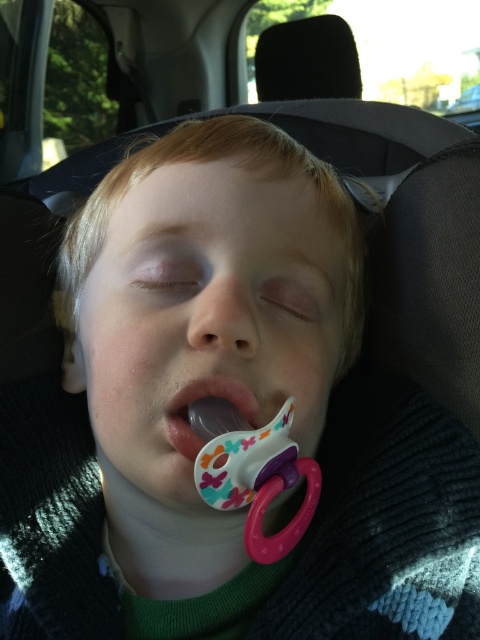
You are a passenger in the car and want to know which of the two points, point (247,448) or point (195,385), is closer to you. Based on the image, which point is nearer to your current position?

Point (247,448) is in front of point (195,385), so it is closer to your current position.

You are a parent trying to ensure your child is safe while driving. You have a white plastic pacifier at center and a black plastic car seat at upper center in the car. Given that the pacifier is 2.43 meters away from the car seat, is it within a safe distance for the child to reach it while secured in the car seat?

The white plastic pacifier at center and black plastic car seat at upper center are 2.43 meters apart. Since the child is secured in the car seat, reaching 2.43 meters away would likely be unsafe as it is too far for a child to comfortably or safely access while restrained. Ensure the pacifier is placed within easy reach, ideally within arm s length of the child.

From the picture: You are a parent holding a 12 inch long stuffed animal. You want to place it on the car seat next to the matte plastic pacifier at center so your child can reach it while sleeping. Will the stuffed animal fit within the space available between the pacifier and the edge of the car seat?

The matte plastic pacifier at center is 12.10 inches from the viewer. Since the stuffed animal is 12 inches long, it should fit within the space available as the distance from the pacifier to the edge is slightly larger than the stuffed animal.